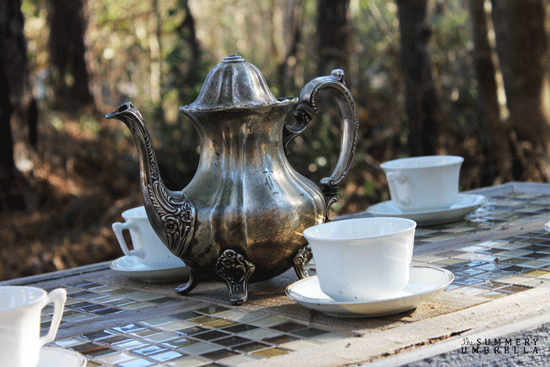
Locate an element on the screen. The height and width of the screenshot is (367, 550). pitcher is located at coordinates (250, 193).